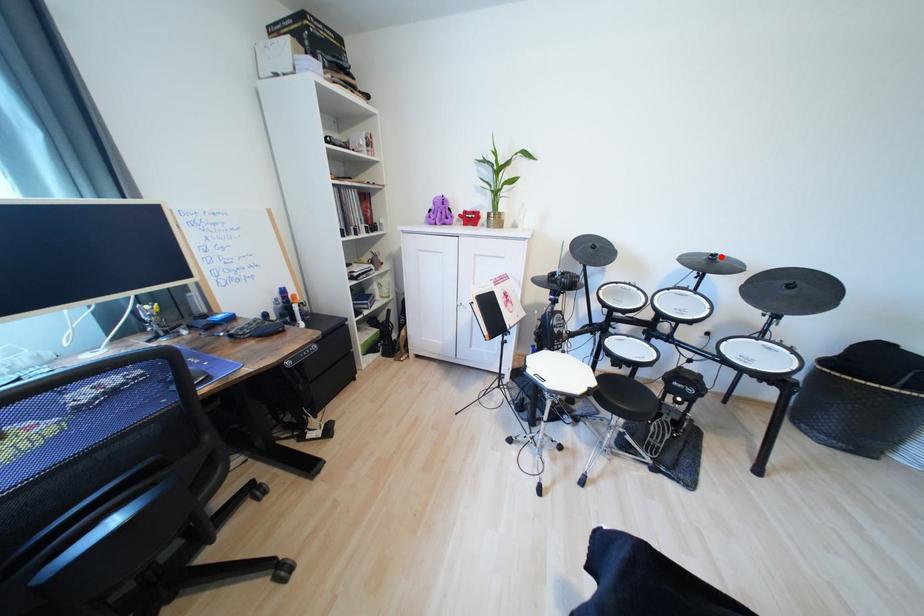
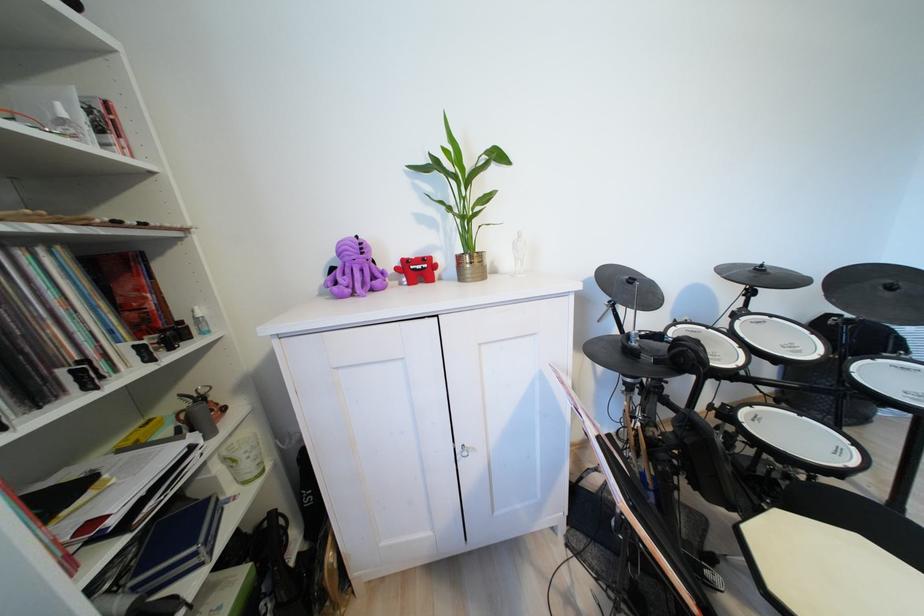
Locate, in the second image, the point that corresponds to the highlighted location in the first image.

(769, 267)